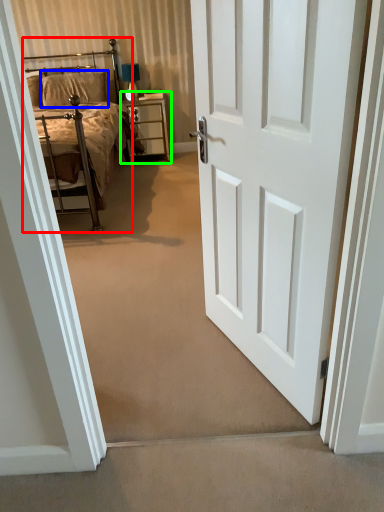
Question: Which object is positioned closest to bed (highlighted by a red box)? Select from pillow (highlighted by a blue box) and nightstand (highlighted by a green box).

Choices:
 (A) pillow
 (B) nightstand

Answer: (B)